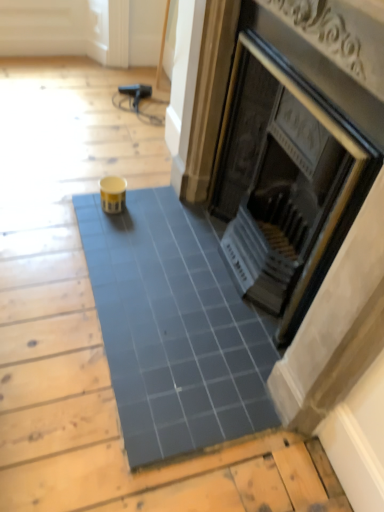
Question: Can you confirm if blue glossy tile at center is bigger than matte black fireplace at center?

Choices:
 (A) yes
 (B) no

Answer: (B)

Question: From the image's perspective, would you say blue glossy tile at center is shown under matte black fireplace at center?

Choices:
 (A) no
 (B) yes

Answer: (B)

Question: Would you say matte black fireplace at center is part of blue glossy tile at center's contents?

Choices:
 (A) no
 (B) yes

Answer: (A)

Question: Is blue glossy tile at center not close to matte black fireplace at center?

Choices:
 (A) yes
 (B) no

Answer: (B)

Question: Is blue glossy tile at center at the right side of matte black fireplace at center?

Choices:
 (A) yes
 (B) no

Answer: (B)

Question: Is blue glossy tile at center wider than matte black fireplace at center?

Choices:
 (A) yes
 (B) no

Answer: (A)

Question: Does matte black fireplace at center have a larger size compared to blue glossy tile at center?

Choices:
 (A) no
 (B) yes

Answer: (B)

Question: From the image's perspective, is matte black fireplace at center above blue glossy tile at center?

Choices:
 (A) no
 (B) yes

Answer: (B)

Question: Is matte black fireplace at center thinner than blue glossy tile at center?

Choices:
 (A) yes
 (B) no

Answer: (A)

Question: Is matte black fireplace at center further to camera compared to blue glossy tile at center?

Choices:
 (A) no
 (B) yes

Answer: (A)

Question: Is matte black fireplace at center looking in the opposite direction of blue glossy tile at center?

Choices:
 (A) no
 (B) yes

Answer: (A)

Question: Can you confirm if matte black fireplace at center is wider than blue glossy tile at center?

Choices:
 (A) no
 (B) yes

Answer: (A)

Question: From the image's perspective, is blue glossy tile at center above or below matte black fireplace at center?

Choices:
 (A) below
 (B) above

Answer: (A)